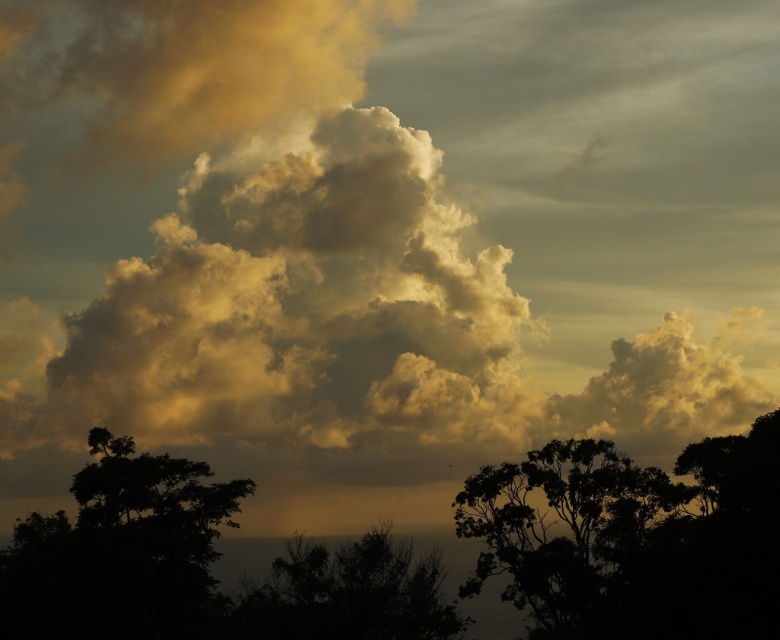
Question: Considering the real-world distances, which object is closest to the dark green leafy tree at center?

Choices:
 (A) silhouette leafy tree at lower right
 (B) dark green leafy tree at lower left

Answer: (B)

Question: Is silhouette leafy tree at lower right positioned before dark green leafy tree at lower left?

Choices:
 (A) yes
 (B) no

Answer: (A)

Question: Considering the real-world distances, which object is farthest from the silhouette leafy tree at lower right?

Choices:
 (A) dark green leafy tree at center
 (B) dark green leafy tree at lower left

Answer: (B)

Question: Which point appears farthest from the camera in this image?

Choices:
 (A) (750, 595)
 (B) (61, 618)
 (C) (387, 566)

Answer: (C)

Question: Is silhouette leafy tree at lower right to the left of dark green leafy tree at center from the viewer's perspective?

Choices:
 (A) no
 (B) yes

Answer: (A)

Question: In this image, where is dark green leafy tree at lower left located relative to dark green leafy tree at center?

Choices:
 (A) right
 (B) left

Answer: (B)